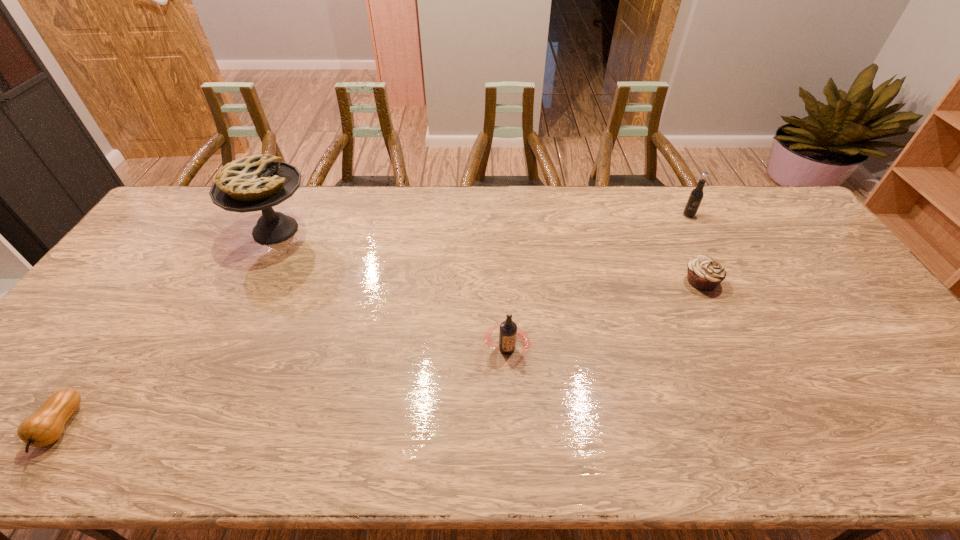
Locate an element on the screen. This screenshot has height=540, width=960. free space between the gourd and the fourth object from right to left is located at coordinates (168, 328).

The height and width of the screenshot is (540, 960). I want to click on blank region between the third object from left to right and the tallest object, so click(392, 289).

Point out which object is positioned as the fourth nearest to the left root beer. Please provide its 2D coordinates. Your answer should be formatted as a tuple, i.e. [(x, y)], where the tuple contains the x and y coordinates of a point satisfying the conditions above.

[(43, 428)]

Select which object appears as the closest to the right root beer. Please provide its 2D coordinates. Your answer should be formatted as a tuple, i.e. [(x, y)], where the tuple contains the x and y coordinates of a point satisfying the conditions above.

[(705, 273)]

Find the location of `free spot that satisfies the following two spatial constraints: 1. on the label of the right root beer; 2. on the cut side of the pie`. free spot that satisfies the following two spatial constraints: 1. on the label of the right root beer; 2. on the cut side of the pie is located at coordinates (697, 230).

This screenshot has width=960, height=540. In order to click on free space that satisfies the following two spatial constraints: 1. on the cut side of the fourth object from right to left; 2. on the stem side of the nearest object in this screenshot , I will do `click(178, 427)`.

You are a GUI agent. You are given a task and a screenshot of the screen. Output one action in this format:
    pyautogui.click(x=<x>, y=<y>)
    Task: Click on the blank area in the image that satisfies the following two spatial constraints: 1. on the back side of the muffin; 2. on the cut side of the fourth object from right to left
    
    Given the screenshot: What is the action you would take?
    pyautogui.click(x=677, y=230)